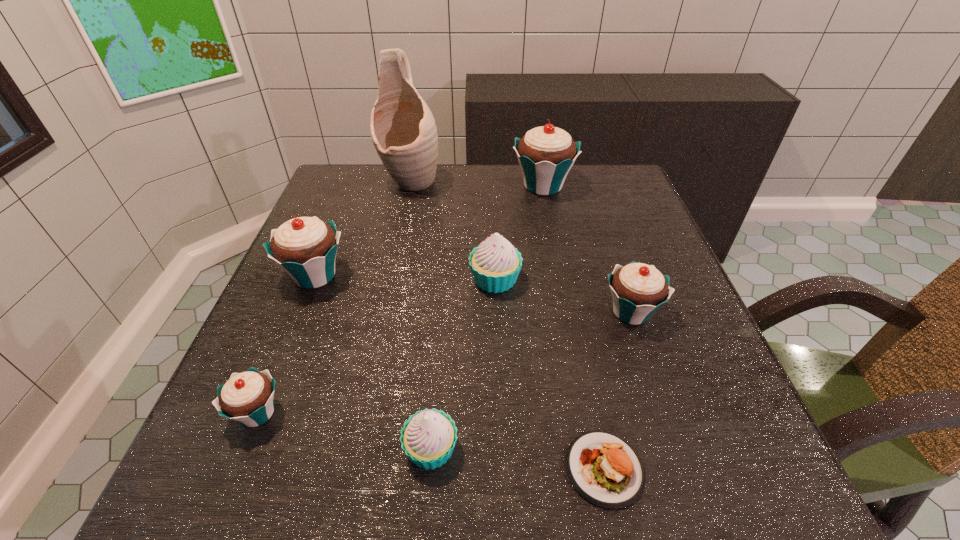
Locate an element on the screen. The image size is (960, 540). free space at the right edge of the desktop is located at coordinates (647, 231).

I want to click on vacant space at the far left corner of the desktop, so click(329, 186).

Find the location of a particular element. vacant space at the far right corner of the desktop is located at coordinates (609, 192).

I want to click on empty space between the shortest object and the second smallest teal cupcake, so click(x=617, y=390).

The height and width of the screenshot is (540, 960). Find the location of `free space between the shortest object and the pitcher`. free space between the shortest object and the pitcher is located at coordinates (508, 325).

At what (x,y) coordinates should I click in order to perform the action: click on unoccupied area between the third smallest teal cupcake and the farthest cupcake. Please return your answer as a coordinate pair (x, y). This screenshot has width=960, height=540. Looking at the image, I should click on (429, 231).

Where is `vacant space that's between the third tallest object and the smaller white cupcake`? This screenshot has width=960, height=540. vacant space that's between the third tallest object and the smaller white cupcake is located at coordinates (372, 362).

Image resolution: width=960 pixels, height=540 pixels. I want to click on free space between the tallest object and the second smallest teal cupcake, so click(521, 247).

Find the location of a particular element. The height and width of the screenshot is (540, 960). vacant space in between the fifth shortest cupcake and the tallest object is located at coordinates (363, 228).

Identify the location of vacant space in between the second biggest teal cupcake and the nearest teal cupcake. The width and height of the screenshot is (960, 540). point(286,344).